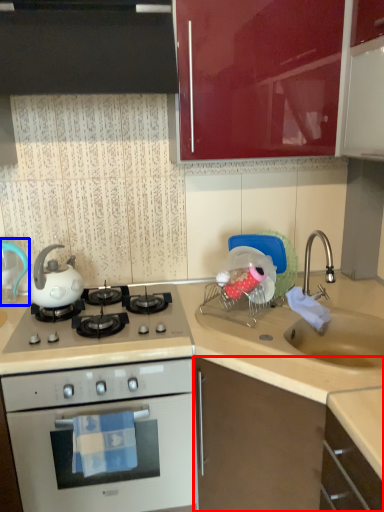
Question: Which object appears closest to the camera in this image, cabinetry (highlighted by a red box) or kitchen appliance (highlighted by a blue box)?

Choices:
 (A) cabinetry
 (B) kitchen appliance

Answer: (A)